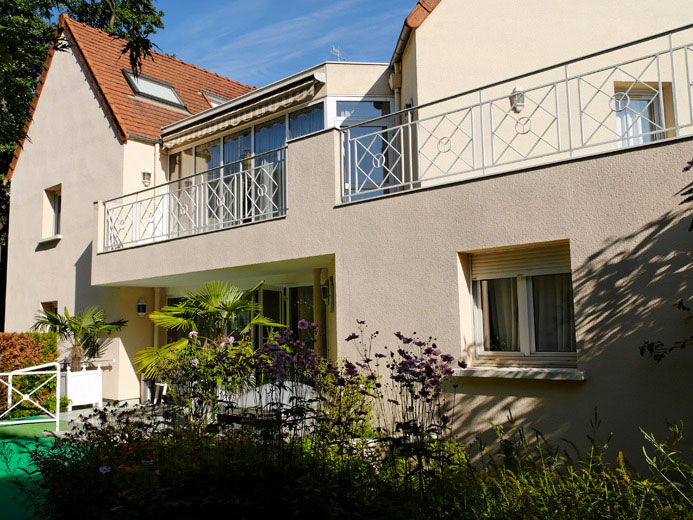
Locate an element on the screen. Image resolution: width=693 pixels, height=520 pixels. blinds is located at coordinates 482,271.